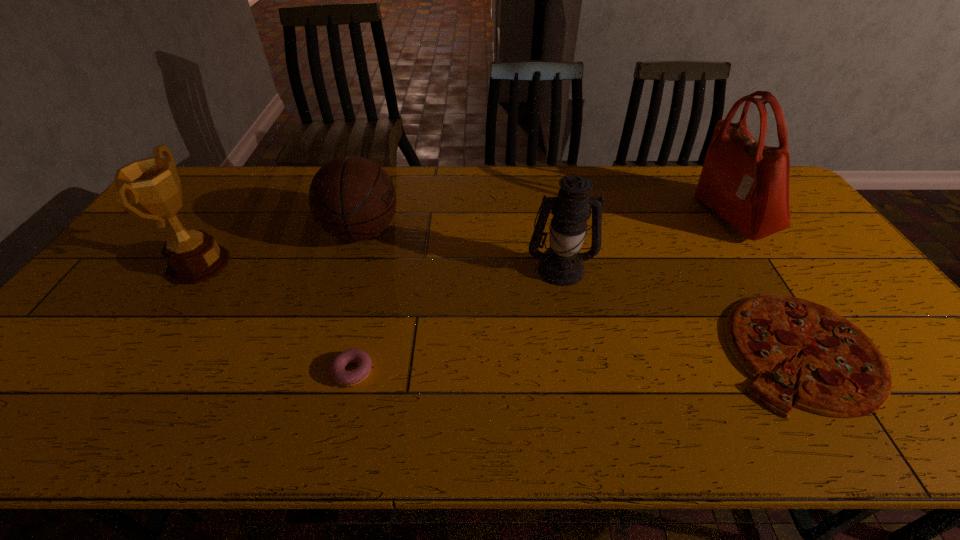
In order to click on the tallest object in this screenshot , I will do `click(746, 183)`.

Where is `award`? The width and height of the screenshot is (960, 540). award is located at coordinates (152, 184).

Identify the location of oil lamp. The height and width of the screenshot is (540, 960). (561, 264).

The image size is (960, 540). What are the coordinates of `basketball` in the screenshot? It's located at (352, 198).

Where is `doughnut`? doughnut is located at coordinates (338, 372).

Identify the location of pizza. The image size is (960, 540). (843, 374).

The image size is (960, 540). Identify the location of free space located 0.160m on the front-facing side of the tallest object. (646, 217).

Locate an element on the screen. The width and height of the screenshot is (960, 540). free location located 0.050m on the front-facing side of the tallest object is located at coordinates (681, 217).

Locate an element on the screen. blank space located on the front-facing side of the tallest object is located at coordinates (634, 217).

The image size is (960, 540). Find the location of `free space located on the front-facing side of the award`. free space located on the front-facing side of the award is located at coordinates (256, 265).